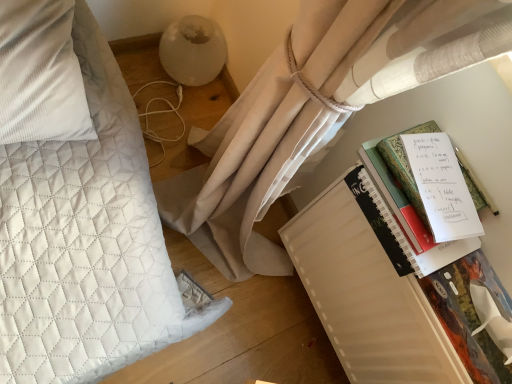
Question: Would you say hardcover book at right, the first paperback book from the front, is to the left or to the right of white paper notebook at right in the picture?

Choices:
 (A) right
 (B) left

Answer: (A)

Question: In terms of height, does hardcover book at right, the first paperback book from the front, look taller or shorter compared to white paper notebook at right?

Choices:
 (A) tall
 (B) short

Answer: (B)

Question: Which object is the closest to the white paper notebook at right?

Choices:
 (A) white matte notebook at right, positioned as the second paperback book in front-to-back order
 (B) white quilted pillow at left
 (C) hardcover book at right, which is the second paperback book from back to front

Answer: (C)

Question: Estimate the real-world distances between objects in this image. Which object is closer to the white quilted pillow at left?

Choices:
 (A) white paper notebook at right
 (B) white matte notebook at right, which is the first paperback book from back to front
 (C) hardcover book at right, which is the second paperback book from back to front

Answer: (A)